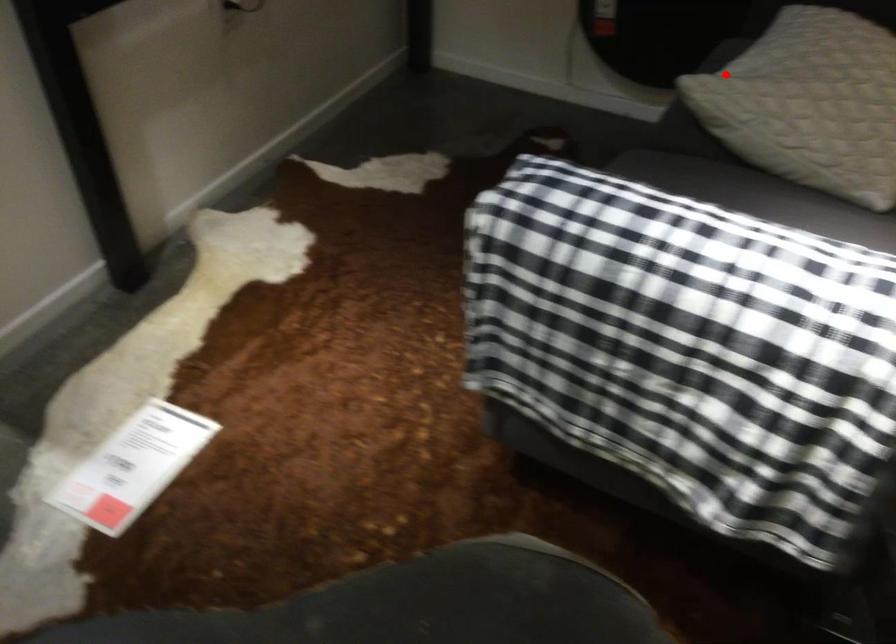
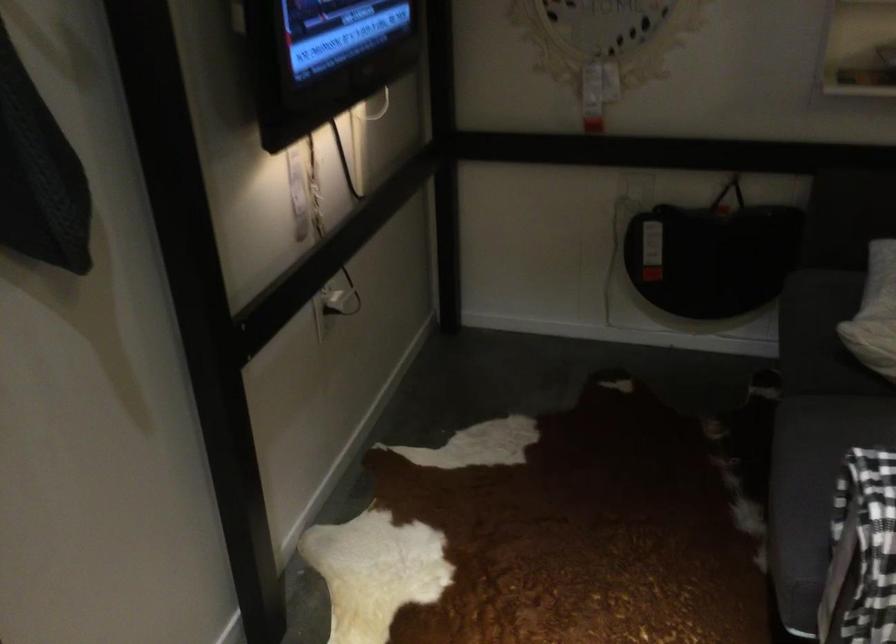
Where in the second image is the point corresponding to the highlighted location from the first image?

(874, 313)